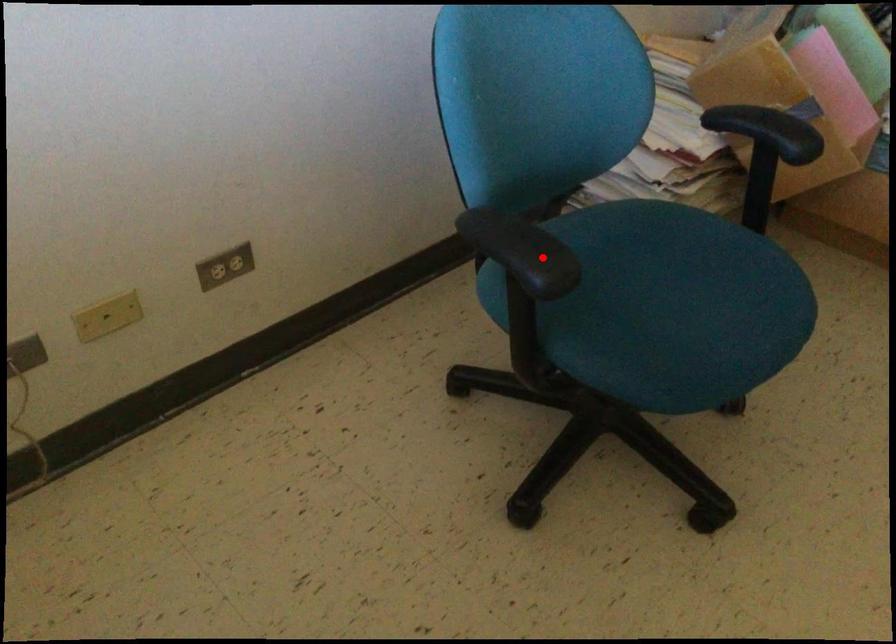
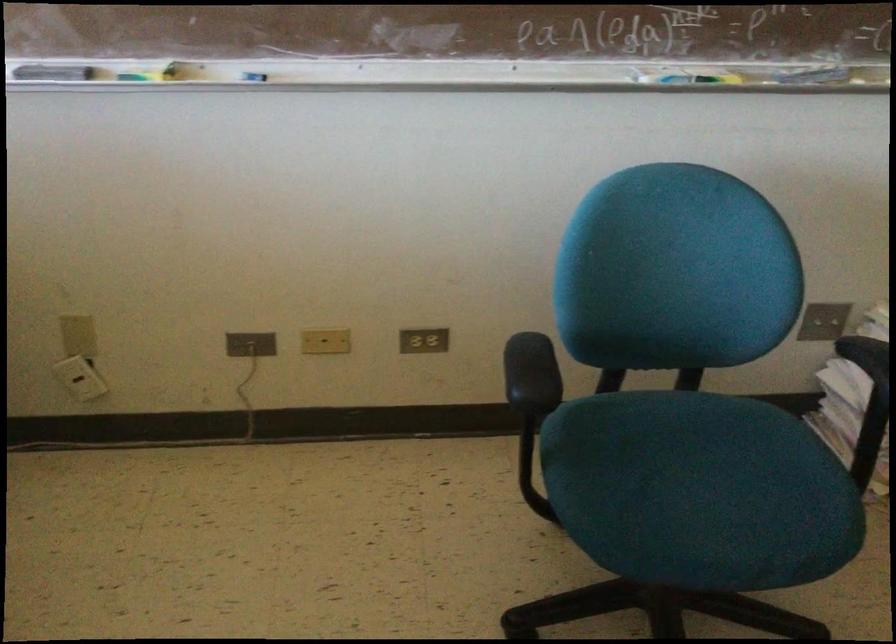
Question: I am providing you with two images of the same scene from different viewpoints. Image1 has a red point marked. In image2, the corresponding 3D location appears at what relative position? Reply with the corresponding letter.

Choices:
 (A) Closer
 (B) Farther

Answer: (B)